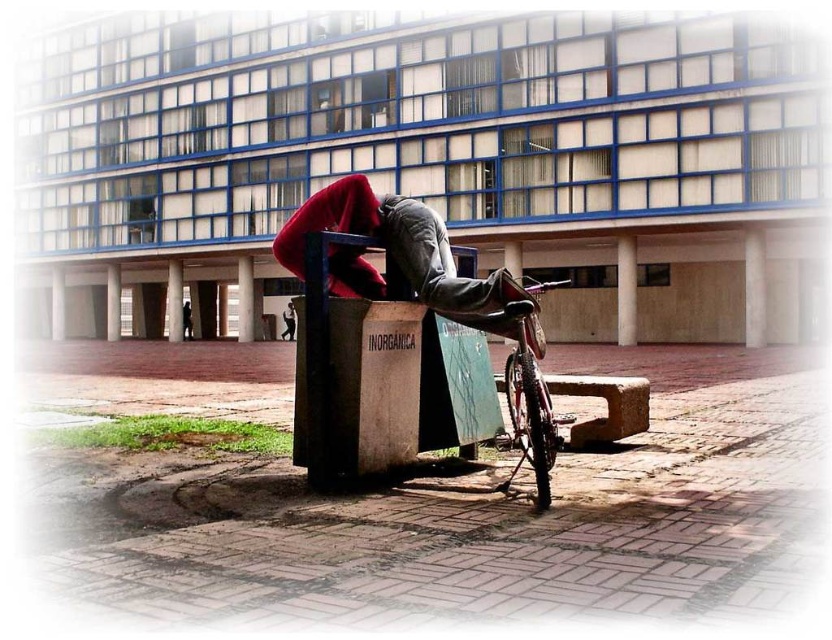
Where is `shiny metallic bicycle at lower right`? This screenshot has width=832, height=640. shiny metallic bicycle at lower right is located at coordinates (528, 394).

Who is higher up, shiny metallic bicycle at lower right or dark gray jeans at center?

Positioned higher is shiny metallic bicycle at lower right.

Locate an element on the screen. shiny metallic bicycle at lower right is located at coordinates (528, 394).

Who is more distant from viewer, [528,428] or [182,328]?

The point [182,328] is behind.

Is point (543, 388) more distant than point (182, 324)?

No, it is in front of (182, 324).

Identify the location of shiny metallic bicycle at lower right. This screenshot has height=640, width=832. (528, 394).

Is point (379, 221) in front of point (518, 372)?

No, it is behind (518, 372).

Between red fabric at center and shiny metallic bicycle at lower right, which one has more height?

With more height is red fabric at center.

Who is more forward, (499, 273) or (538, 388)?

Point (538, 388)

This screenshot has width=832, height=640. I want to click on red fabric at center, so click(x=400, y=257).